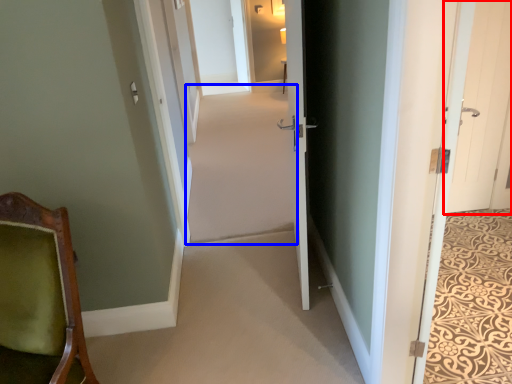
Question: Which point is further to the camera, door (highlighted by a red box) or plain (highlighted by a blue box)?

Choices:
 (A) door
 (B) plain

Answer: (A)